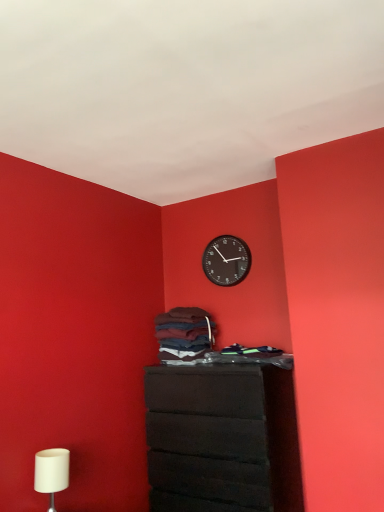
Measure the distance between matte black chest of drawers at center and camera.

matte black chest of drawers at center is 2.22 meters away from camera.

Find the location of a particular element. This screenshot has width=384, height=512. black plastic wall clock at upper center is located at coordinates (226, 260).

Where is `white matte table lamp at lower left`? The height and width of the screenshot is (512, 384). white matte table lamp at lower left is located at coordinates (51, 472).

Is black plastic wall clock at upper center in front of or behind dark blue cotton laundry at center in the image?

In the image, black plastic wall clock at upper center appears behind dark blue cotton laundry at center.

Considering the relative sizes of black plastic wall clock at upper center and dark blue cotton laundry at center in the image provided, is black plastic wall clock at upper center smaller than dark blue cotton laundry at center?

Correct, black plastic wall clock at upper center occupies less space than dark blue cotton laundry at center.

Which is more distant, (x=248, y=253) or (x=167, y=314)?

Point (x=248, y=253)

From the image's perspective, between black plastic wall clock at upper center and dark blue cotton laundry at center, who is located below?

dark blue cotton laundry at center.

Considering the sizes of dark blue cotton laundry at center and black plastic wall clock at upper center in the image, is dark blue cotton laundry at center taller or shorter than black plastic wall clock at upper center?

dark blue cotton laundry at center is shorter than black plastic wall clock at upper center.

Where is `wall clock to the right of dark blue cotton laundry at center`? wall clock to the right of dark blue cotton laundry at center is located at coordinates (226, 260).

Considering the positions of points (209, 330) and (221, 267), is point (209, 330) closer to camera compared to point (221, 267)?

That is True.

From a real-world perspective, which object rests below the other?

dark blue cotton laundry at center.

Is white matte table lamp at lower left directly adjacent to matte black chest of drawers at center?

white matte table lamp at lower left and matte black chest of drawers at center are not in contact.

Considering the relative positions of white matte table lamp at lower left and matte black chest of drawers at center in the image provided, is white matte table lamp at lower left to the left of matte black chest of drawers at center from the viewer's perspective?

Indeed, white matte table lamp at lower left is positioned on the left side of matte black chest of drawers at center.

From a real-world perspective, does white matte table lamp at lower left stand above matte black chest of drawers at center?

Yes, from a real-world perspective, white matte table lamp at lower left is on top of matte black chest of drawers at center.

Considering the relative sizes of white matte table lamp at lower left and matte black chest of drawers at center in the image provided, is white matte table lamp at lower left taller than matte black chest of drawers at center?

No, white matte table lamp at lower left is not taller than matte black chest of drawers at center.

Are matte black chest of drawers at center and white matte table lamp at lower left located far from each other?

No, matte black chest of drawers at center is not far from white matte table lamp at lower left.

Where is `table lamp above the matte black chest of drawers at center (from a real-world perspective)`? The image size is (384, 512). table lamp above the matte black chest of drawers at center (from a real-world perspective) is located at coordinates (51, 472).

Which object is closer to the camera taking this photo, matte black chest of drawers at center or white matte table lamp at lower left?

white matte table lamp at lower left is closer to the camera.

Between matte black chest of drawers at center and white matte table lamp at lower left, which one appears on the left side from the viewer's perspective?

white matte table lamp at lower left is more to the left.

Visually, is matte black chest of drawers at center positioned to the left or to the right of black plastic wall clock at upper center?

Clearly, matte black chest of drawers at center is on the left of black plastic wall clock at upper center in the image.

Are matte black chest of drawers at center and black plastic wall clock at upper center located far from each other?

matte black chest of drawers at center is near black plastic wall clock at upper center, not far away.

Is matte black chest of drawers at center smaller than black plastic wall clock at upper center?

Incorrect, matte black chest of drawers at center is not smaller in size than black plastic wall clock at upper center.

Can you tell me how much matte black chest of drawers at center and black plastic wall clock at upper center differ in facing direction?

2.42 degrees.

Is dark blue cotton laundry at center inside matte black chest of drawers at center?

No, dark blue cotton laundry at center is not surrounded by matte black chest of drawers at center.

Is matte black chest of drawers at center far from dark blue cotton laundry at center?

matte black chest of drawers at center is actually quite close to dark blue cotton laundry at center.

Considering the relative positions of matte black chest of drawers at center and dark blue cotton laundry at center in the image provided, is matte black chest of drawers at center to the left of dark blue cotton laundry at center from the viewer's perspective?

No.

Based on the photo, is white matte table lamp at lower left far from black plastic wall clock at upper center?

white matte table lamp at lower left is positioned a significant distance from black plastic wall clock at upper center.

Between white matte table lamp at lower left and black plastic wall clock at upper center, which one has smaller width?

With smaller width is black plastic wall clock at upper center.

From the picture: Is white matte table lamp at lower left bigger than black plastic wall clock at upper center?

Indeed, white matte table lamp at lower left has a larger size compared to black plastic wall clock at upper center.

In the image, there is a dark blue cotton laundry at center. Identify the location of wall clock above it (from the image's perspective). (226, 260).

The image size is (384, 512). What are the coordinates of `wall clock located above the dark blue cotton laundry at center (from a real-world perspective)` in the screenshot? It's located at (226, 260).

Estimate the real-world distances between objects in this image. Which object is further from dark blue cotton laundry at center, black plastic wall clock at upper center or white matte table lamp at lower left?

The object further to dark blue cotton laundry at center is white matte table lamp at lower left.

Looking at the image, which one is located closer to matte black chest of drawers at center, dark blue cotton laundry at center or black plastic wall clock at upper center?

dark blue cotton laundry at center is closer to matte black chest of drawers at center.

Estimate the real-world distances between objects in this image. Which object is further from white matte table lamp at lower left, black plastic wall clock at upper center or dark blue cotton laundry at center?

black plastic wall clock at upper center.

Which object lies nearer to the anchor point matte black chest of drawers at center, black plastic wall clock at upper center or white matte table lamp at lower left?

white matte table lamp at lower left lies closer to matte black chest of drawers at center than the other object.

From the image, which object appears to be nearer to white matte table lamp at lower left, matte black chest of drawers at center or black plastic wall clock at upper center?

matte black chest of drawers at center is closer to white matte table lamp at lower left.

Considering their positions, is white matte table lamp at lower left positioned closer to matte black chest of drawers at center than dark blue cotton laundry at center?

dark blue cotton laundry at center.

Looking at the image, which one is located further to white matte table lamp at lower left, black plastic wall clock at upper center or matte black chest of drawers at center?

black plastic wall clock at upper center is further to white matte table lamp at lower left.

Considering their positions, is black plastic wall clock at upper center positioned further to dark blue cotton laundry at center than matte black chest of drawers at center?

black plastic wall clock at upper center is positioned further to the anchor dark blue cotton laundry at center.

Image resolution: width=384 pixels, height=512 pixels. In order to click on laundry between black plastic wall clock at upper center and matte black chest of drawers at center from top to bottom in this screenshot , I will do `click(184, 334)`.

Where is `table lamp that lies between black plastic wall clock at upper center and matte black chest of drawers at center from top to bottom`? This screenshot has height=512, width=384. table lamp that lies between black plastic wall clock at upper center and matte black chest of drawers at center from top to bottom is located at coordinates (51, 472).

Locate an element on the screen. This screenshot has width=384, height=512. laundry between white matte table lamp at lower left and matte black chest of drawers at center from left to right is located at coordinates (184, 334).

Locate an element on the screen. Image resolution: width=384 pixels, height=512 pixels. laundry between black plastic wall clock at upper center and white matte table lamp at lower left in the vertical direction is located at coordinates (184, 334).